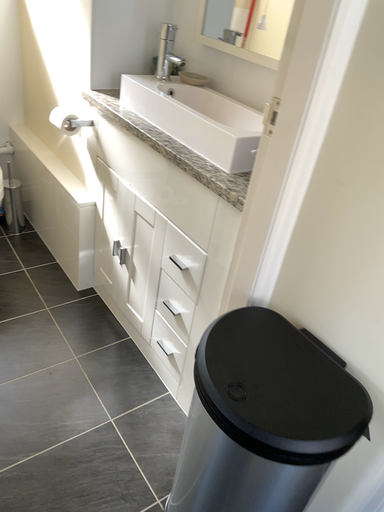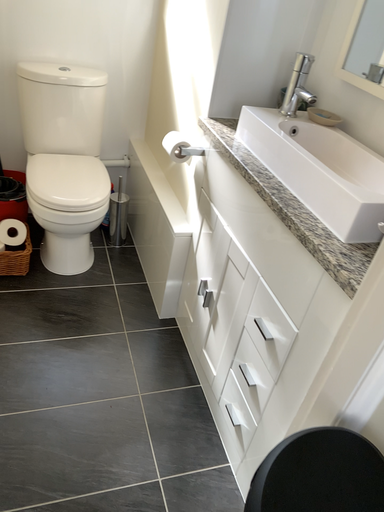
Question: Which way did the camera rotate in the video?

Choices:
 (A) rotated right
 (B) rotated left

Answer: (B)